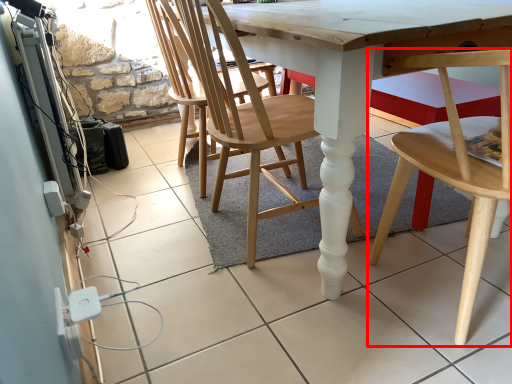
Question: From the image's perspective, what is the correct spatial positioning of chair (annotated by the red box) in reference to chair?

Choices:
 (A) above
 (B) below

Answer: (B)